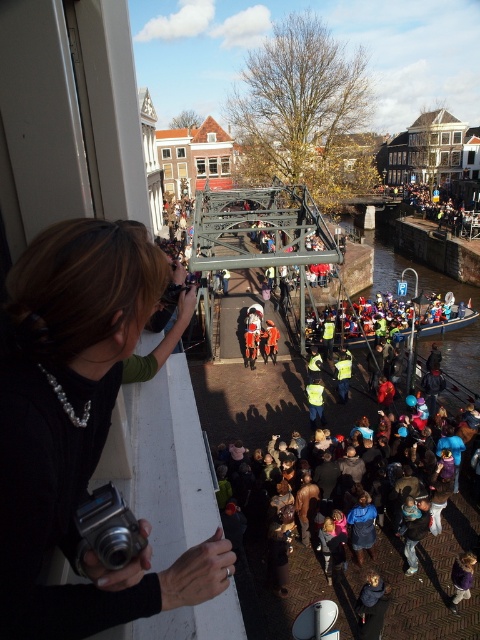
You are a photographer trying to capture the performers in the center of the scene. You have two cameras available, the black fabric camera at left and the silver metallic camera at lower left. Which camera is positioned closer to the performers?

The black fabric camera at left is positioned closer to the performers because the silver metallic camera at lower left is behind it, indicating it is further away.

You are a photographer who needs to choose a camera that is taller. Which one between the black fabric camera at left and the silver metallic camera at lower left should you pick?

The silver metallic camera at lower left is taller than the black fabric camera at left, so you should pick the silver metallic camera at lower left.

You are a photographer who needs to choose between the black fabric camera at left and the silver metallic camera at lower left to capture a quick shot of the performers. Which camera can you hold more easily in one hand?

The black fabric camera at left is thinner than the silver metallic camera at lower left, so it can be held more easily in one hand.